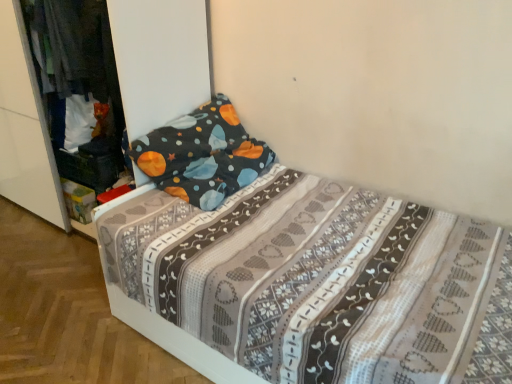
Question: Is the depth of dark blue fabric at left less than that of patterned fabric bed at center?

Choices:
 (A) yes
 (B) no

Answer: (B)

Question: Is patterned fabric bed at center a part of dark blue fabric at left?

Choices:
 (A) no
 (B) yes

Answer: (A)

Question: From the image's perspective, is dark blue fabric at left on top of patterned fabric bed at center?

Choices:
 (A) yes
 (B) no

Answer: (A)

Question: Does dark blue fabric at left turn towards patterned fabric bed at center?

Choices:
 (A) no
 (B) yes

Answer: (A)

Question: From a real-world perspective, is dark blue fabric at left located beneath patterned fabric bed at center?

Choices:
 (A) no
 (B) yes

Answer: (A)

Question: Is dark blue fabric at left bigger or smaller than patterned fabric bed at center?

Choices:
 (A) small
 (B) big

Answer: (A)

Question: Considering their positions, is dark blue fabric at left located in front of or behind patterned fabric bed at center?

Choices:
 (A) front
 (B) behind

Answer: (B)

Question: Is dark blue fabric at left to the left or to the right of patterned fabric bed at center in the image?

Choices:
 (A) left
 (B) right

Answer: (A)

Question: From the image's perspective, is dark blue fabric at left above or below patterned fabric bed at center?

Choices:
 (A) below
 (B) above

Answer: (B)

Question: From a real-world perspective, is white fabric bed at center physically located above or below patterned fabric bed at center?

Choices:
 (A) above
 (B) below

Answer: (A)

Question: Would you say white fabric bed at center is to the left or to the right of patterned fabric bed at center in the picture?

Choices:
 (A) right
 (B) left

Answer: (B)

Question: Does point pyautogui.click(x=184, y=16) appear closer or farther from the camera than point pyautogui.click(x=245, y=297)?

Choices:
 (A) farther
 (B) closer

Answer: (A)

Question: Relative to patterned fabric bed at center, is white fabric bed at center in front or behind?

Choices:
 (A) front
 (B) behind

Answer: (B)

Question: Considering the positions of dark blue fabric at left and white fabric bed at center in the image, is dark blue fabric at left wider or thinner than white fabric bed at center?

Choices:
 (A) thin
 (B) wide

Answer: (A)

Question: Considering the positions of point (67, 18) and point (172, 38), is point (67, 18) closer or farther from the camera than point (172, 38)?

Choices:
 (A) closer
 (B) farther

Answer: (B)